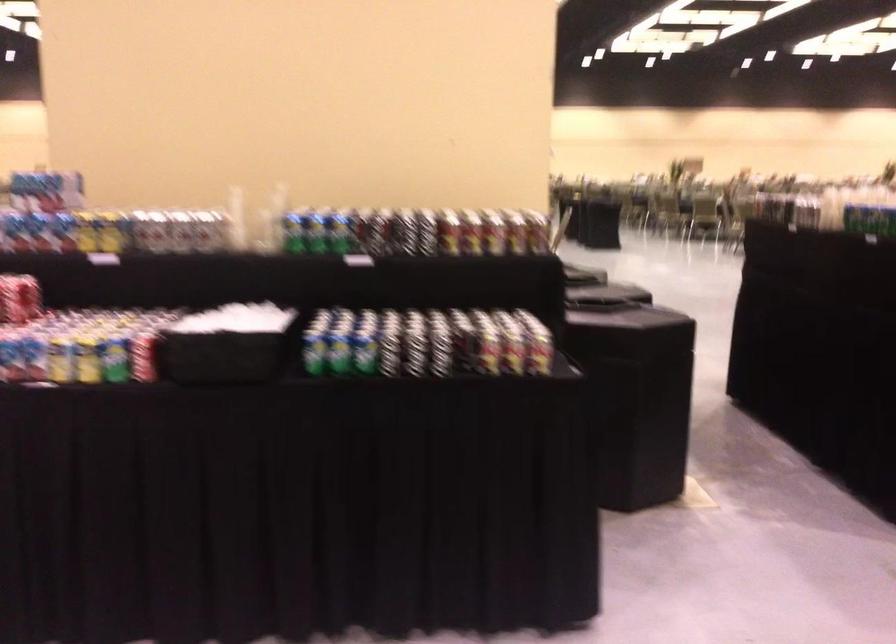
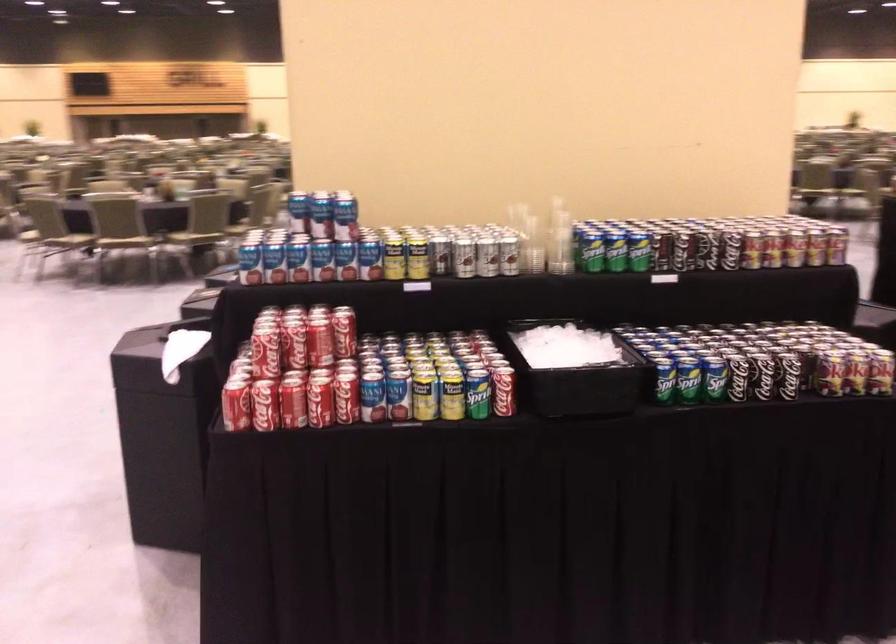
Question: Based on the continuous images, in which direction is the camera rotating? Reply with the corresponding letter.

Choices:
 (A) Left
 (B) Right
 (C) Up
 (D) Down

Answer: (D)